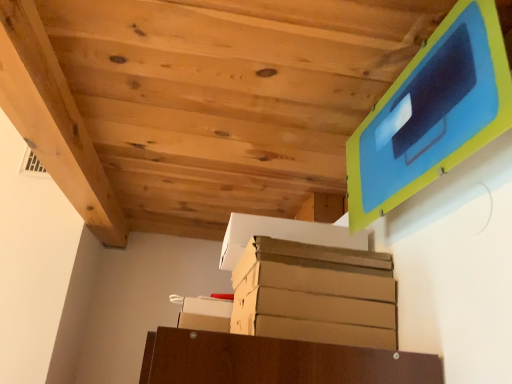
Question: Which direction should I rotate to look at white cardboard box at lower center, acting as the 1th cardboard box starting from the left?

Choices:
 (A) right
 (B) left

Answer: (B)

Question: Does white cardboard box at lower center, acting as the 1th cardboard box starting from the left, have a greater width compared to brown cardboard box at center, which ranks as the second cardboard box in bottom-to-top order?

Choices:
 (A) no
 (B) yes

Answer: (A)

Question: Is white cardboard box at lower center, placed as the 2th cardboard box when sorted from top to bottom, further to camera compared to brown cardboard box at center, arranged as the second cardboard box when viewed from the left?

Choices:
 (A) yes
 (B) no

Answer: (A)

Question: Is white cardboard box at lower center, acting as the 1th cardboard box starting from the left, oriented away from brown cardboard box at center, which is counted as the first cardboard box, starting from the right?

Choices:
 (A) yes
 (B) no

Answer: (B)

Question: From a real-world perspective, is white cardboard box at lower center, the second cardboard box in the right-to-left sequence, located beneath brown cardboard box at center, arranged as the second cardboard box when viewed from the left?

Choices:
 (A) no
 (B) yes

Answer: (B)

Question: Is white cardboard box at lower center, acting as the 1th cardboard box starting from the left, not close to brown cardboard box at center, which is counted as the first cardboard box, starting from the right?

Choices:
 (A) yes
 (B) no

Answer: (B)

Question: Is white cardboard box at lower center, the second cardboard box in the right-to-left sequence, in front of brown cardboard box at center, which is the first cardboard box from top to bottom?

Choices:
 (A) no
 (B) yes

Answer: (A)

Question: Is brown cardboard box at center, which ranks as the second cardboard box in bottom-to-top order, to the left of white cardboard box at lower center, placed as the 2th cardboard box when sorted from top to bottom, from the viewer's perspective?

Choices:
 (A) no
 (B) yes

Answer: (A)

Question: Is brown cardboard box at center, which ranks as the second cardboard box in bottom-to-top order, positioned with its back to white cardboard box at lower center, the second cardboard box in the right-to-left sequence?

Choices:
 (A) yes
 (B) no

Answer: (B)

Question: Could white cardboard box at lower center, the second cardboard box in the right-to-left sequence, be considered to be inside brown cardboard box at center, arranged as the second cardboard box when viewed from the left?

Choices:
 (A) yes
 (B) no

Answer: (B)

Question: Is brown cardboard box at center, which is the first cardboard box from top to bottom, not inside white cardboard box at lower center, the second cardboard box in the right-to-left sequence?

Choices:
 (A) no
 (B) yes

Answer: (B)

Question: Is brown cardboard box at center, which ranks as the second cardboard box in bottom-to-top order, wider than white cardboard box at lower center, placed as the 2th cardboard box when sorted from top to bottom?

Choices:
 (A) yes
 (B) no

Answer: (A)

Question: Would you consider brown cardboard box at center, which is the first cardboard box from top to bottom, to be distant from white cardboard box at lower center, the second cardboard box in the right-to-left sequence?

Choices:
 (A) yes
 (B) no

Answer: (B)

Question: Looking at their shapes, would you say brown cardboard box at center, which ranks as the second cardboard box in bottom-to-top order, is wider or thinner than white cardboard box at lower center, which appears as the 1th cardboard box when ordered from the bottom?

Choices:
 (A) thin
 (B) wide

Answer: (B)